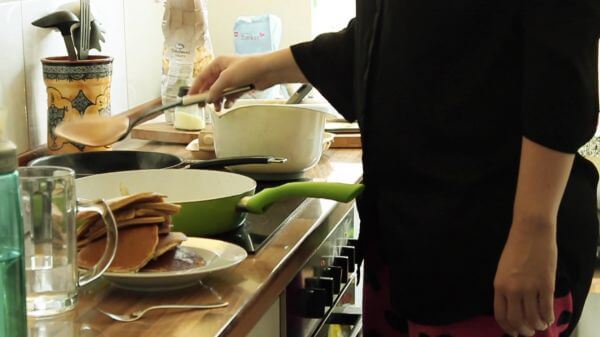
You are a GUI agent. You are given a task and a screenshot of the screen. Output one action in this format:
    pyautogui.click(x=<x>, y=<y>)
    Task: Click on the frying pans
    The image size is (600, 337).
    Given the screenshot: What is the action you would take?
    pyautogui.click(x=208, y=214), pyautogui.click(x=133, y=159)